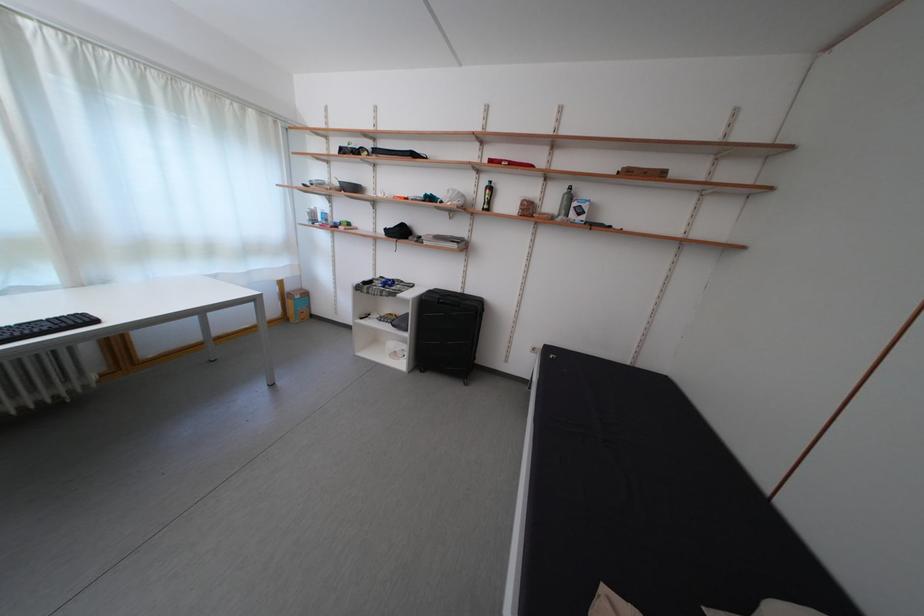
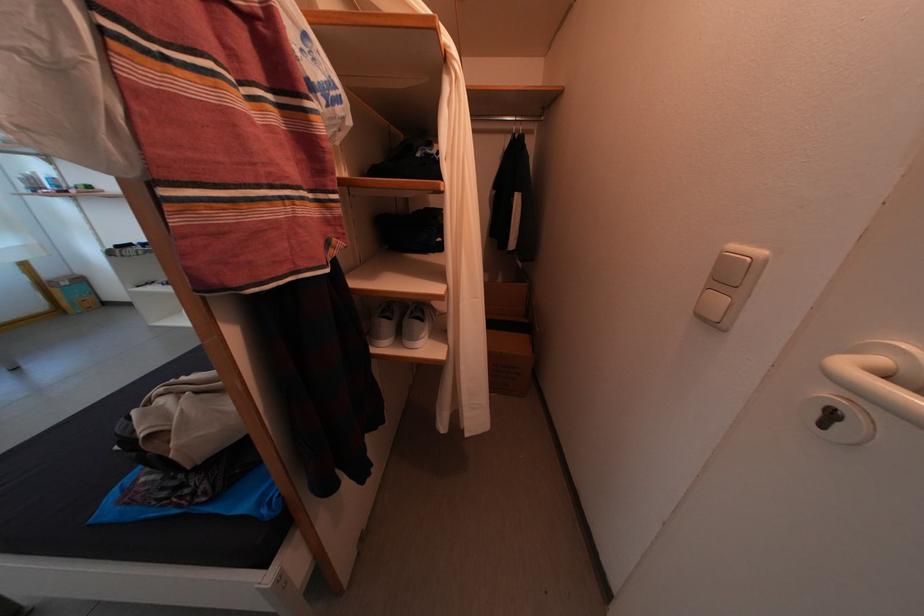
In a continuous first-person perspective shot, in which direction is the camera moving?

The cameraman moved toward right, backward.